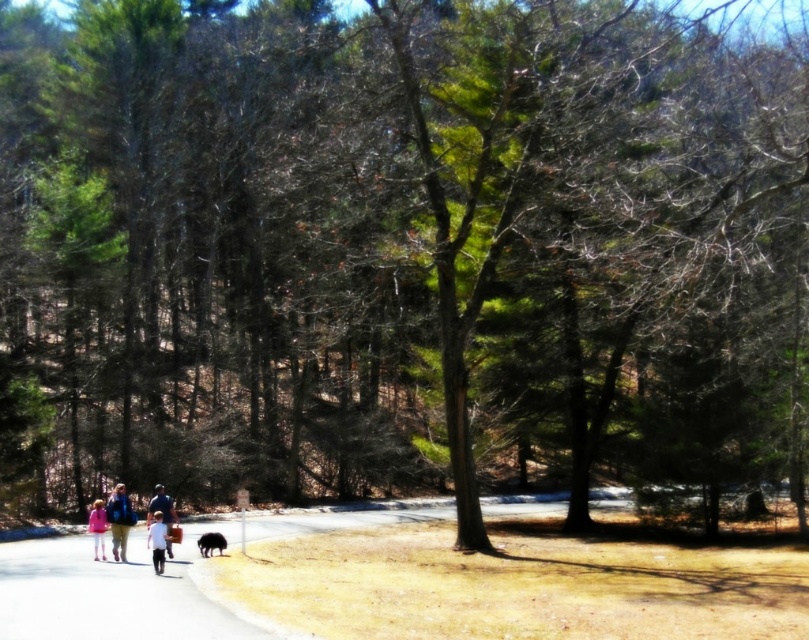
Is point (107, 509) positioned after point (151, 502)?

Yes.

Is point (107, 508) positioned before point (164, 499)?

No, (107, 508) is behind (164, 499).

Find the location of a particular element. Image resolution: width=809 pixels, height=640 pixels. blue denim jacket at lower left is located at coordinates (119, 520).

Can you confirm if white cotton shirt at center is positioned to the left of black fur dog at center?

Indeed, white cotton shirt at center is positioned on the left side of black fur dog at center.

Image resolution: width=809 pixels, height=640 pixels. Identify the location of white cotton shirt at center. (161, 508).

Identify the location of white matte shirt at center. The image size is (809, 640). (157, 541).

Between white matte shirt at center and black fur dog at center, which one is positioned lower?

Positioned lower is black fur dog at center.

Measure the distance between white matte shirt at center and camera.

16.31 meters

This screenshot has width=809, height=640. I want to click on white matte shirt at center, so click(x=157, y=541).